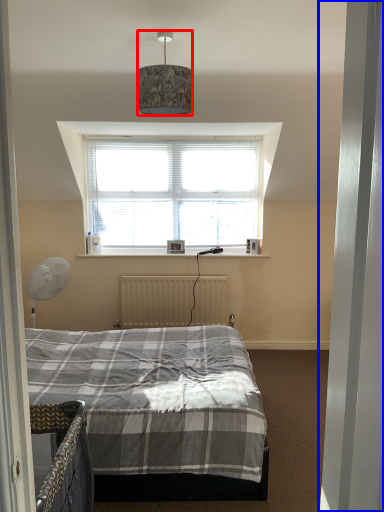
Question: Which object appears closest to the camera in this image, lamp (highlighted by a red box) or door (highlighted by a blue box)?

Choices:
 (A) lamp
 (B) door

Answer: (B)